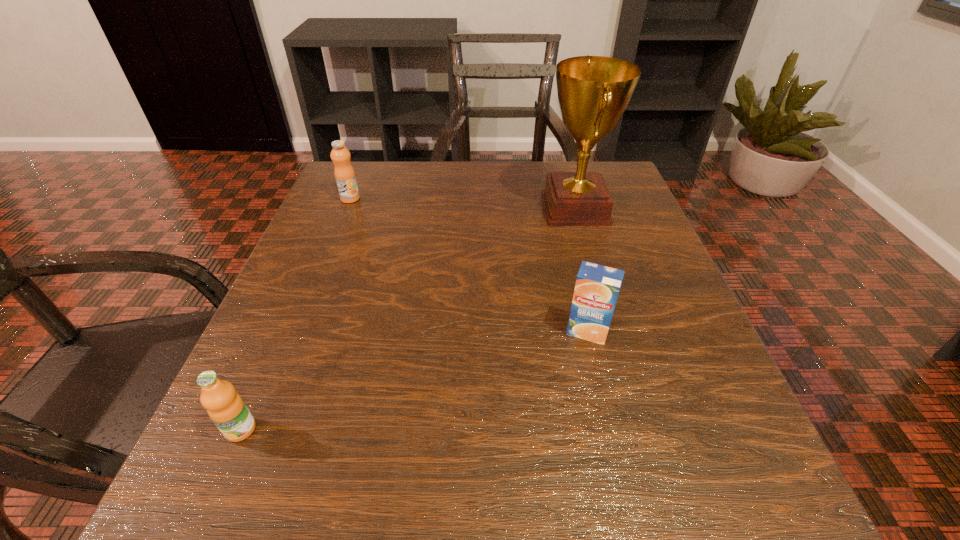
The width and height of the screenshot is (960, 540). In order to click on free space at the right edge in this screenshot , I will do `click(591, 237)`.

This screenshot has width=960, height=540. In the image, there is a desktop. In order to click on vacant space at the far left corner in this screenshot , I will do `click(359, 170)`.

Locate an element on the screen. vacant position at the near left corner of the desktop is located at coordinates (278, 507).

The width and height of the screenshot is (960, 540). In order to click on vacant space at the far right corner in this screenshot , I will do `click(560, 166)`.

The height and width of the screenshot is (540, 960). Identify the location of vacant position at the near right corner of the desktop. (778, 490).

The width and height of the screenshot is (960, 540). Identify the location of free space between the rightmost orange juice and the farthest orange juice. tap(468, 265).

The height and width of the screenshot is (540, 960). Identify the location of free space between the nearest object and the award. point(408,319).

I want to click on vacant space that is in between the third farthest object and the nearest object, so click(414, 380).

You are a GUI agent. You are given a task and a screenshot of the screen. Output one action in this format:
    pyautogui.click(x=<x>, y=<y>)
    Task: Click on the free spot between the award and the nearest object
    This screenshot has height=540, width=960.
    Given the screenshot: What is the action you would take?
    pyautogui.click(x=408, y=319)

The height and width of the screenshot is (540, 960). I want to click on vacant region between the award and the nearest orange juice, so click(x=408, y=319).